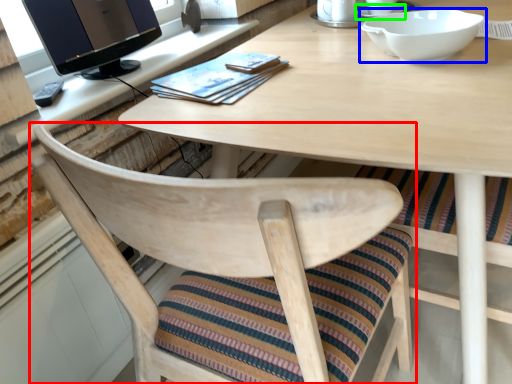
Question: Estimate the real-world distances between objects in this image. Which object is closer to chair (highlighted by a red box), bowl (highlighted by a blue box) or saucer (highlighted by a green box)?

Choices:
 (A) bowl
 (B) saucer

Answer: (A)